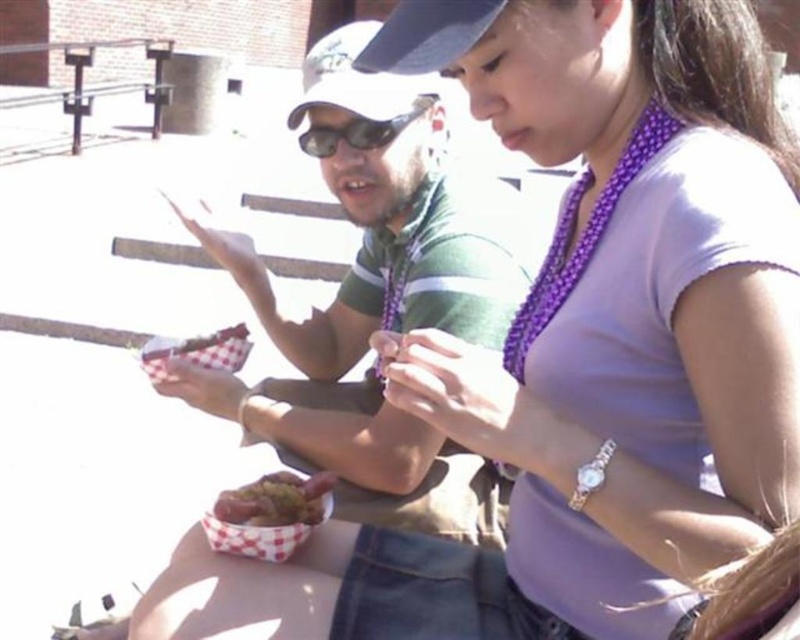
Is point (316, 496) farther from camera compared to point (430, 104)?

No.

Does shiny metallic hot dog at center have a larger size compared to sunglasses at center?

No, shiny metallic hot dog at center is not bigger than sunglasses at center.

Does point (324, 493) come behind point (388, 120)?

No, (324, 493) is closer to viewer.

Locate an element on the screen. The height and width of the screenshot is (640, 800). shiny metallic hot dog at center is located at coordinates click(276, 500).